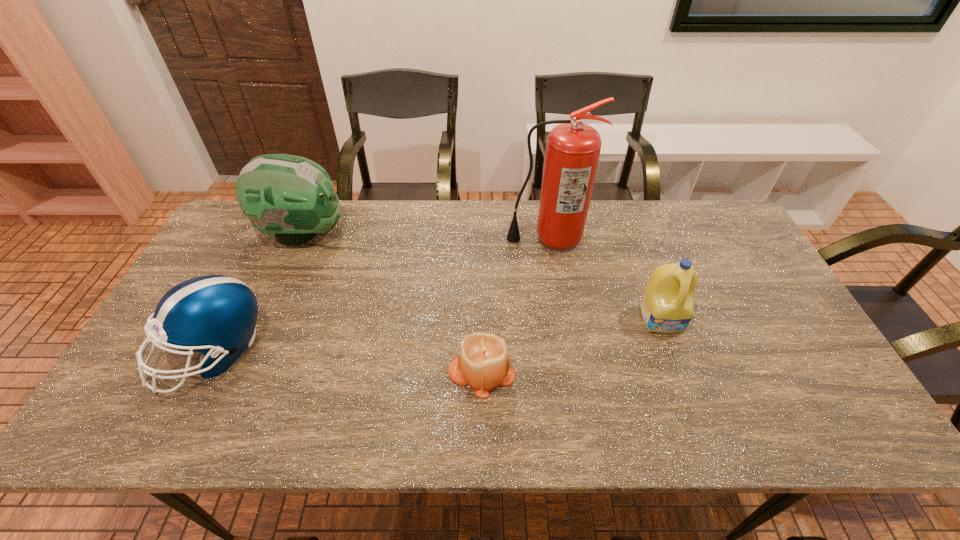
Find the location of `the tallest object`. the tallest object is located at coordinates (573, 148).

Where is `the taller football helmet`? The image size is (960, 540). the taller football helmet is located at coordinates (291, 198).

You are a GUI agent. You are given a task and a screenshot of the screen. Output one action in this format:
    pyautogui.click(x=<x>, y=<y>)
    Task: Click on the farther football helmet
    
    Given the screenshot: What is the action you would take?
    pyautogui.click(x=291, y=198)

The width and height of the screenshot is (960, 540). Find the location of `the rightmost object`. the rightmost object is located at coordinates (667, 304).

Identify the location of the nearer football helmet. (213, 314).

Find the location of a particular element. The image size is (960, 540). the shortest object is located at coordinates pos(483,364).

At what (x,y) coordinates should I click in order to perform the action: click on vacant space situated on the instruction side of the fire extinguisher. Please return your answer as a coordinate pair (x, y). Looking at the image, I should click on (556, 294).

Locate an element on the screen. This screenshot has height=540, width=960. blank space located on the visor of the farther football helmet is located at coordinates (465, 233).

What are the coordinates of `vacant space located on the label of the detergent` in the screenshot? It's located at (695, 408).

Where is `vacant space located on the back of the shortest object`? vacant space located on the back of the shortest object is located at coordinates (481, 316).